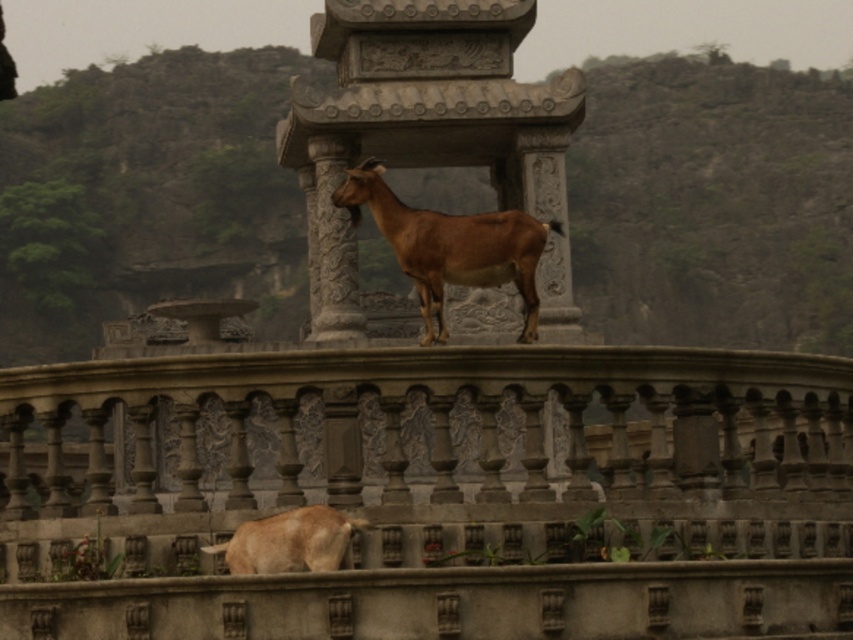
Question: Estimate the real-world distances between objects in this image. Which object is farther from the brown stone hillside at upper center?

Choices:
 (A) gray stone balustrade at lower center
 (B) brown matte goat at center
 (C) brown matte goat at lower center

Answer: (C)

Question: Among these objects, which one is farthest from the camera?

Choices:
 (A) gray stone balustrade at lower center
 (B) brown stone hillside at upper center
 (C) brown matte goat at center

Answer: (B)

Question: Can you confirm if gray stone balustrade at lower center is thinner than brown stone hillside at upper center?

Choices:
 (A) no
 (B) yes

Answer: (B)

Question: Can you confirm if brown stone hillside at upper center is bigger than brown matte goat at center?

Choices:
 (A) yes
 (B) no

Answer: (A)

Question: Among these objects, which one is farthest from the camera?

Choices:
 (A) brown stone hillside at upper center
 (B) brown matte goat at lower center

Answer: (A)

Question: Can you confirm if gray stone balustrade at lower center is wider than brown matte goat at lower center?

Choices:
 (A) yes
 (B) no

Answer: (A)